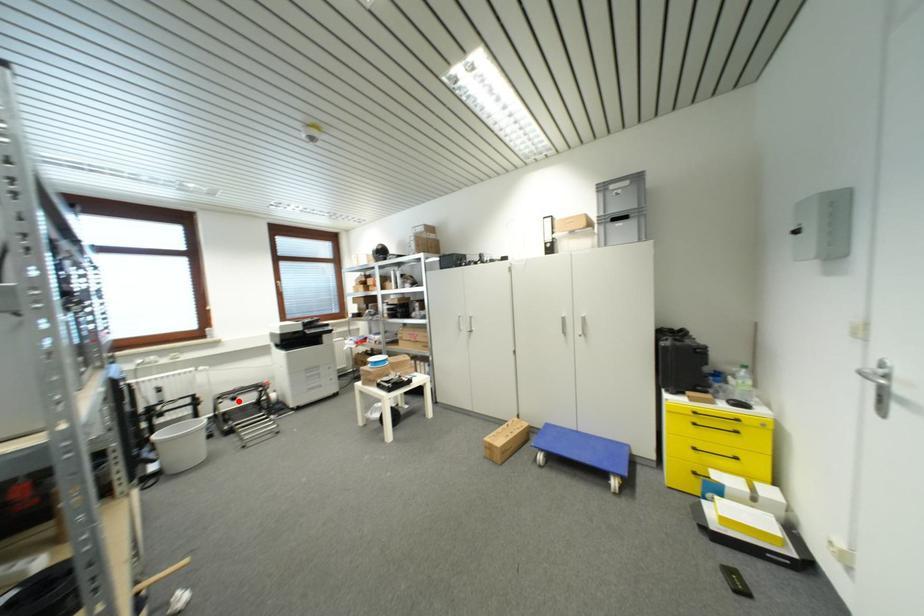
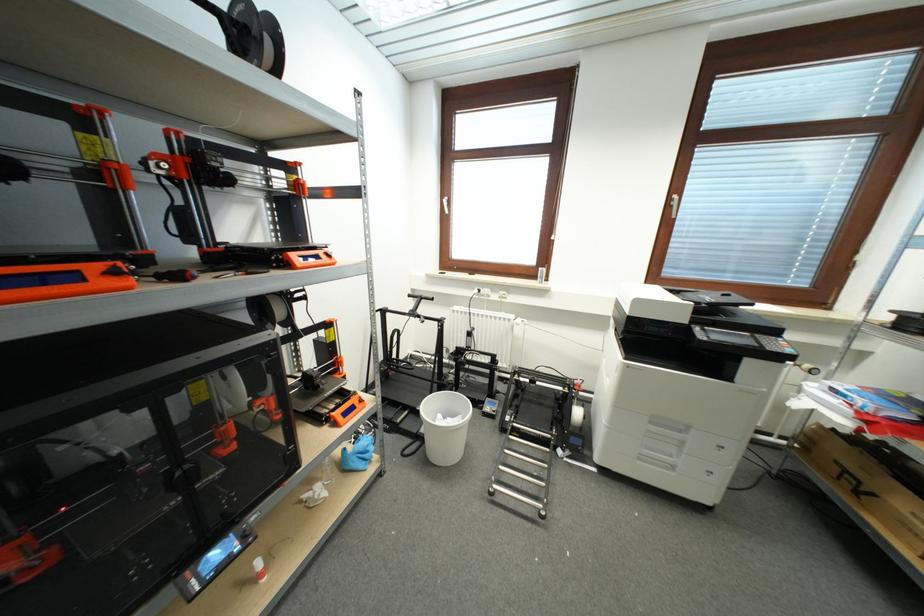
Locate, in the second image, the point that corresponds to the highlighted location in the first image.

(537, 384)